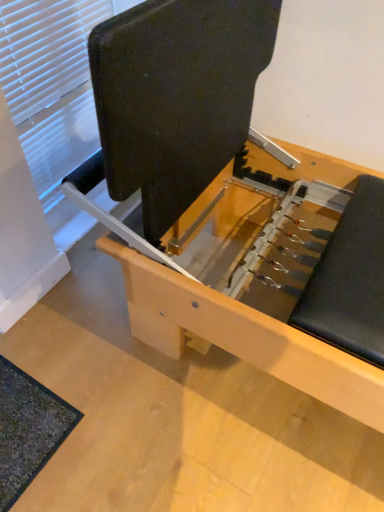
Image resolution: width=384 pixels, height=512 pixels. What are the coordinates of `free space above dark green textured mat at lower left (from a real-world perspective)` in the screenshot? It's located at (23, 420).